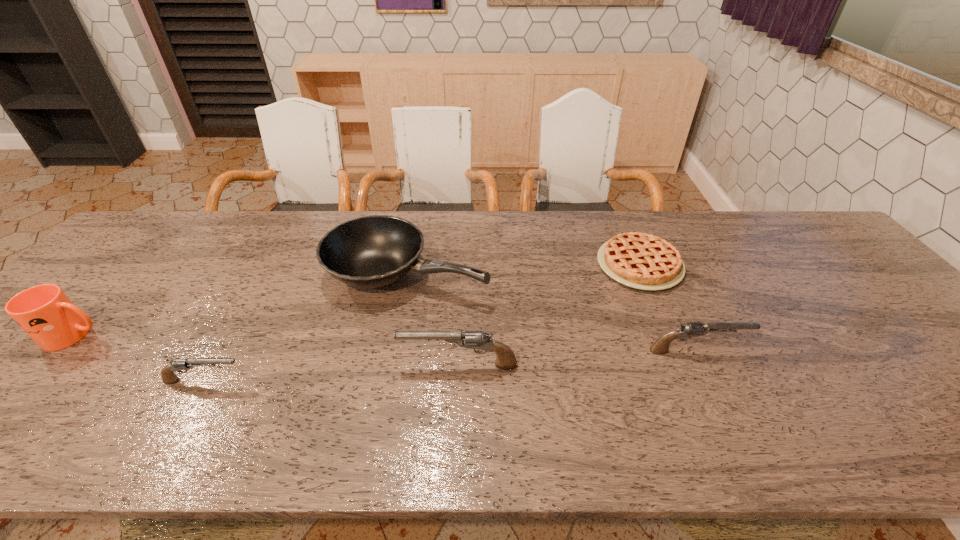
At what (x,y) coordinates should I click in order to perform the action: click on free space between the leftmost object and the frying pan. Please return your answer as a coordinate pair (x, y). This screenshot has height=540, width=960. Looking at the image, I should click on (241, 305).

This screenshot has height=540, width=960. In order to click on empty space that is in between the mug and the frying pan in this screenshot , I will do `click(241, 305)`.

This screenshot has width=960, height=540. Find the location of `free space between the frying pan and the rightmost gun`. free space between the frying pan and the rightmost gun is located at coordinates (552, 312).

Locate an element on the screen. The height and width of the screenshot is (540, 960). vacant space that is in between the farthest gun and the fifth tallest object is located at coordinates (451, 366).

Locate an element on the screen. The image size is (960, 540). vacant area that lies between the pie and the tallest gun is located at coordinates (549, 315).

Image resolution: width=960 pixels, height=540 pixels. What are the coordinates of `empty location between the leftmost object and the frying pan` in the screenshot? It's located at (241, 305).

Locate which object ranks second in proximity to the tallest gun. Please provide its 2D coordinates. Your answer should be formatted as a tuple, i.e. [(x, y)], where the tuple contains the x and y coordinates of a point satisfying the conditions above.

[(690, 329)]

Locate an element on the screen. object that is the fourth nearest to the rightmost gun is located at coordinates (168, 376).

You are a GUI agent. You are given a task and a screenshot of the screen. Output one action in this format:
    pyautogui.click(x=<x>, y=<y>)
    Task: Click on the second closest gun relative to the shortest object
    The image size is (960, 540).
    Given the screenshot: What is the action you would take?
    pyautogui.click(x=506, y=360)

Choose which gun is the third nearest neighbor to the frying pan. Please provide its 2D coordinates. Your answer should be formatted as a tuple, i.e. [(x, y)], where the tuple contains the x and y coordinates of a point satisfying the conditions above.

[(690, 329)]